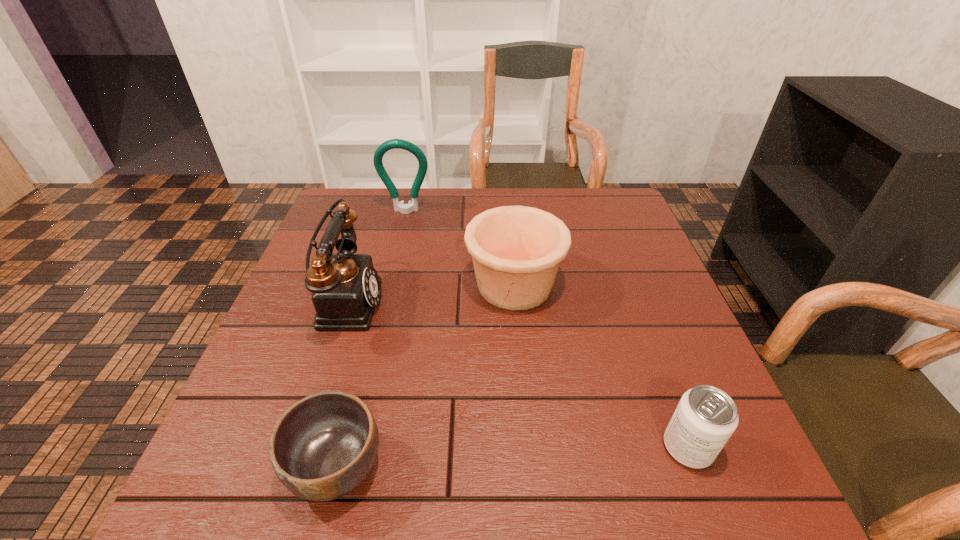
Image resolution: width=960 pixels, height=540 pixels. Find the location of `free space located on the back of the fourth tallest object`. free space located on the back of the fourth tallest object is located at coordinates (653, 355).

At what (x,y) coordinates should I click in order to perform the action: click on blank space located on the back of the shortest object. Please return your answer as a coordinate pair (x, y). The width and height of the screenshot is (960, 540). Looking at the image, I should click on (379, 295).

This screenshot has height=540, width=960. I want to click on object present at the far edge, so [412, 205].

I want to click on soda can situated at the near edge, so click(705, 418).

Image resolution: width=960 pixels, height=540 pixels. What are the coordinates of `bowl at the near edge` in the screenshot? It's located at (323, 446).

Image resolution: width=960 pixels, height=540 pixels. Identify the location of bottle opener at the left edge. (412, 205).

Find the location of `telephone present at the left edge`. telephone present at the left edge is located at coordinates (346, 286).

At what (x,y) coordinates should I click in order to perform the action: click on bowl located at the left edge. Please return your answer as a coordinate pair (x, y). The width and height of the screenshot is (960, 540). Looking at the image, I should click on (323, 446).

Locate an element on the screen. This screenshot has height=540, width=960. object located in the right edge section of the desktop is located at coordinates (705, 418).

This screenshot has width=960, height=540. I want to click on object present at the far left corner, so (x=412, y=205).